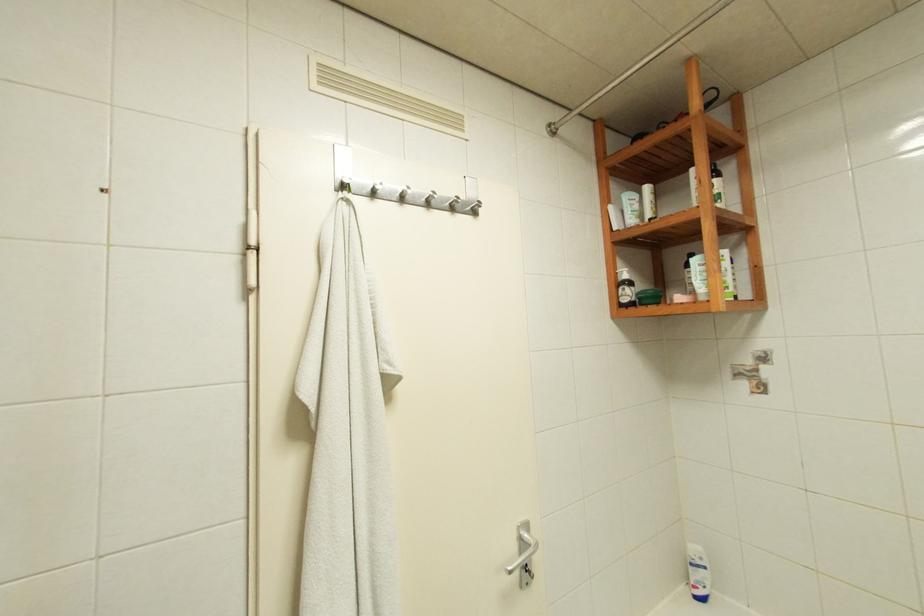
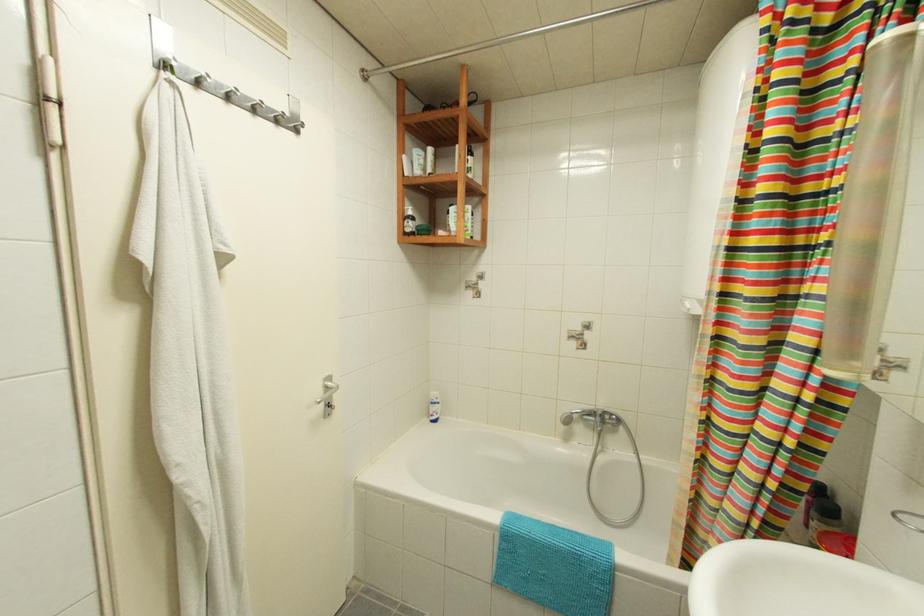
Question: The images are taken continuously from a first-person perspective. In which direction is your viewpoint rotating?

Choices:
 (A) Left
 (B) Right
 (C) Up
 (D) Down

Answer: (B)